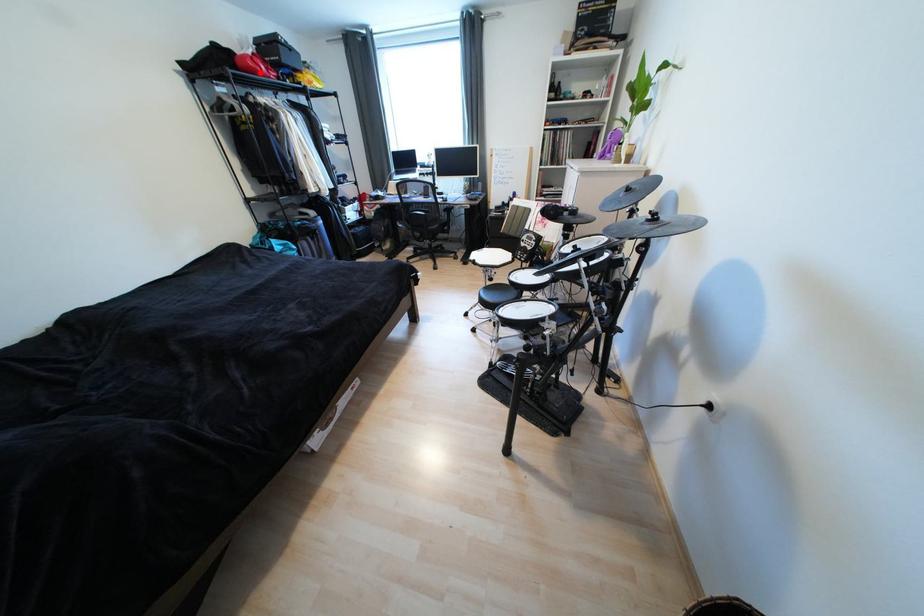
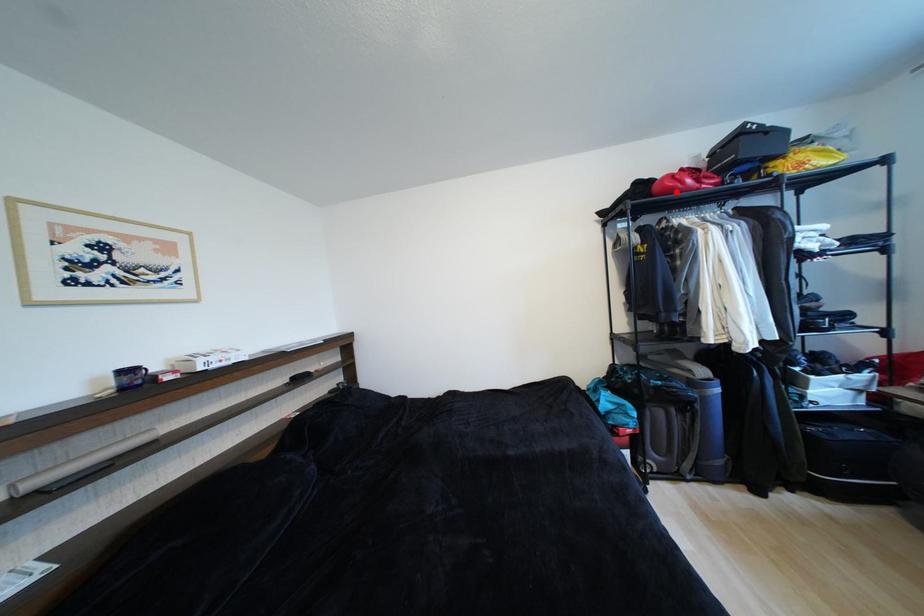
I am providing you with two images of the same scene from different viewpoints. A red point is marked on the first image and another point is marked on the second image. Do the highlighted points in image1 and image2 indicate the same real-world spot?

Yes